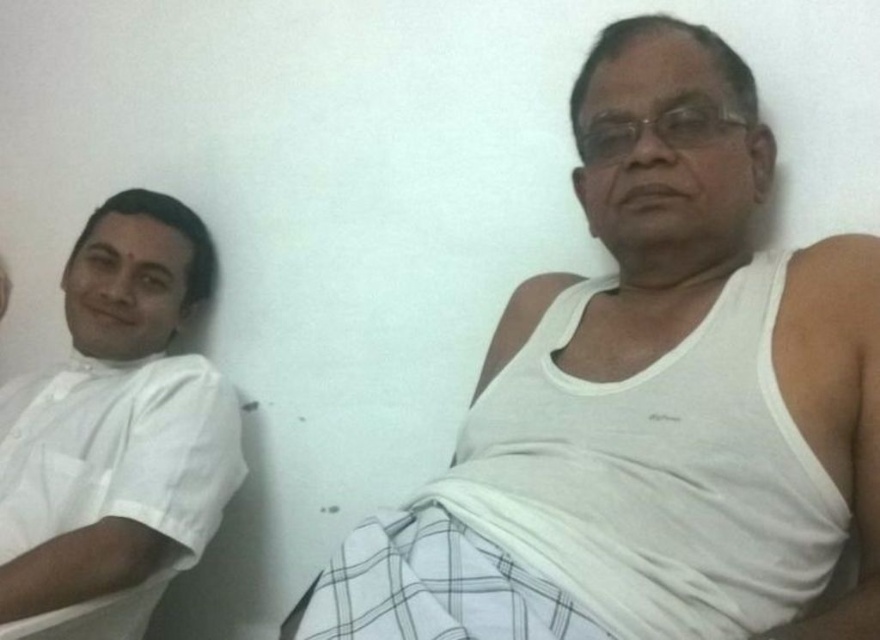
Can you confirm if white cotton tank top at center is bigger than white cotton shirt at left?

Indeed, white cotton tank top at center has a larger size compared to white cotton shirt at left.

Who is more forward, (709, 465) or (199, 456)?

Point (709, 465)

Find the location of a particular element. The width and height of the screenshot is (880, 640). white cotton tank top at center is located at coordinates (649, 403).